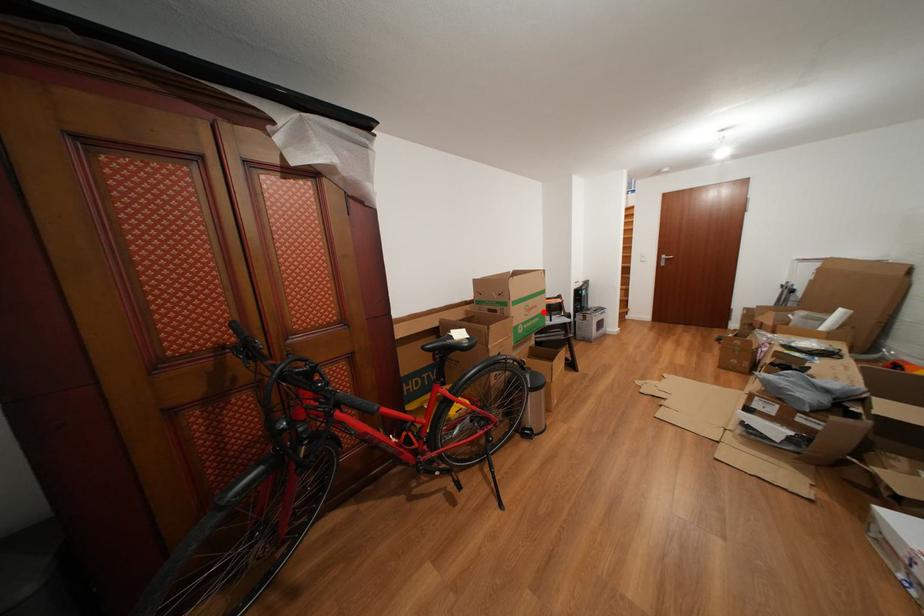
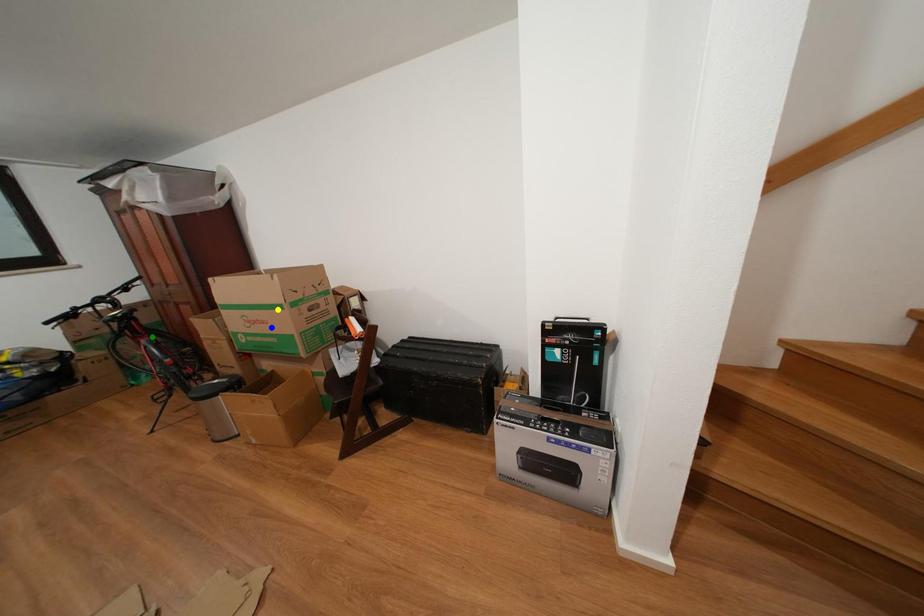
Question: I am providing you with two images of the same scene from different viewpoints. A red point is marked on the first image. You are given multiple points on the second image. In image 2, which mark is for the same physical point as the one in image 1?

Choices:
 (A) blue point
 (B) yellow point
 (C) green point

Answer: (A)